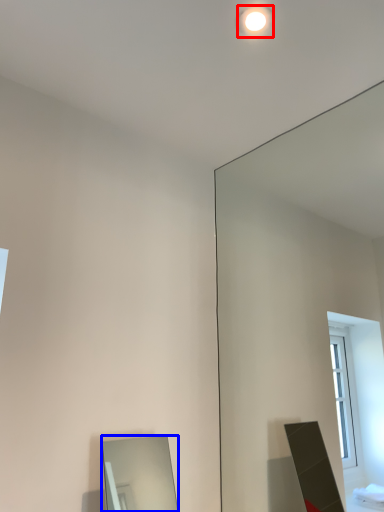
Question: Which of the following is the closest to the observer, lighting (highlighted by a red box) or mirror (highlighted by a blue box)?

Choices:
 (A) lighting
 (B) mirror

Answer: (B)